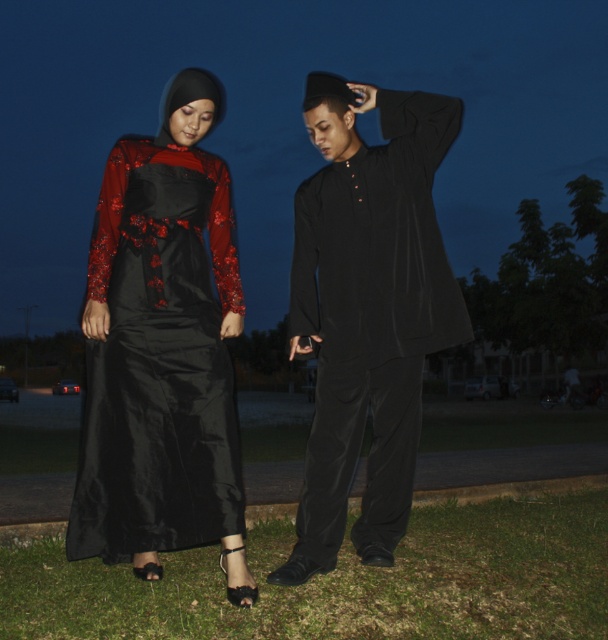
You are a fashion designer observing two outfits in the image. The first is a shiny black dress at left and the second is a matte black kurti at center. Based on their positions, which outfit is closer to the right edge of the image?

The matte black kurti at center is positioned on the right side of the shiny black dress at left, so the matte black kurti at center is closer to the right edge of the image.

You are a photographer taking a picture of two people standing in front of you. You notice two specific points marked in the scene. The first point is at coordinates point (x=376, y=173) and the second is at point (x=323, y=593). Which of these two points is closer to your camera lens?

Point (x=323, y=593) is closer to the camera lens because the description states that point (x=376, y=173) is further away from it.

You are taking a photo of two people standing in the scene. The first person is at point (347, 154) and the second person is at point (528, 582). Which person will appear larger in your photo?

The person at point (347, 154) will appear larger in the photo because they are closer to the camera than the person at point (528, 582).